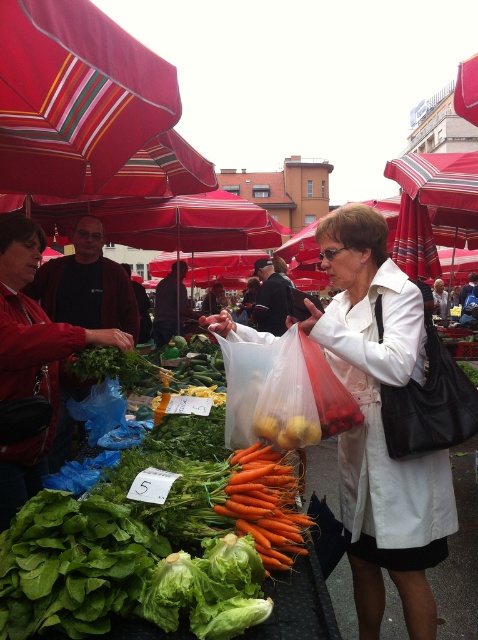
Consider the image. You are a customer at the market and want to pick up the white fabric coat at center and the matte black jacket at center. Which one do you need to reach forward further to grab?

You need to reach forward further to grab the matte black jacket at center because it is farther from you than the white fabric coat at center.

You are a customer at the market and want to pick up the orange matte carrots at center. However, there is a white fabric coat at center in the way. Can you easily reach the carrots without moving the coat?

The white fabric coat at center is taller than the orange matte carrots at center, so you cannot easily reach the carrots without moving the coat.